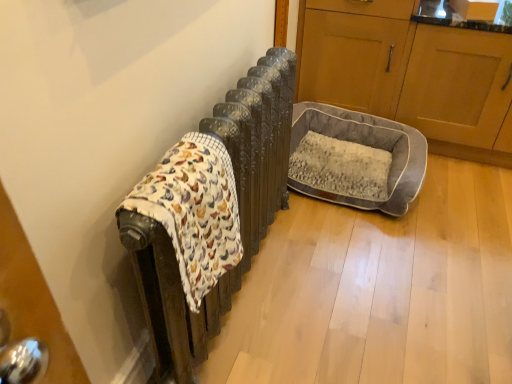
At what (x,y) coordinates should I click in order to perform the action: click on vacant space in front of gray plush dog bed at center. Please return your answer as a coordinate pair (x, y). This screenshot has height=384, width=512. Looking at the image, I should click on (370, 253).